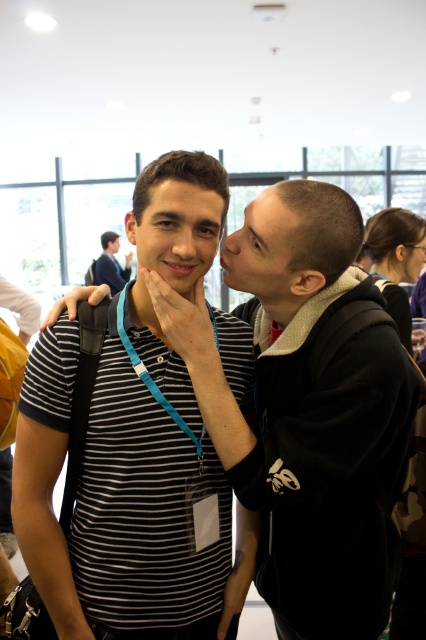
From the picture: Which is more to the right, blue fabric strap at center or blue fabric lanyard at center?

blue fabric lanyard at center

At what (x,y) coordinates should I click in order to perform the action: click on blue fabric strap at center. Please return your answer as a coordinate pair (x, y). The height and width of the screenshot is (640, 426). Looking at the image, I should click on (83, 396).

This screenshot has width=426, height=640. I want to click on blue fabric strap at center, so click(83, 396).

What do you see at coordinates (121, 508) in the screenshot? I see `striped cotton shirt at center` at bounding box center [121, 508].

Can you confirm if striped cotton shirt at center is positioned below blue fabric lanyard at center?

Yes, striped cotton shirt at center is below blue fabric lanyard at center.

Between point (57, 568) and point (166, 404), which one is positioned behind?

The point (166, 404) is behind.

You are a GUI agent. You are given a task and a screenshot of the screen. Output one action in this format:
    pyautogui.click(x=<x>, y=<y>)
    Task: Click on the striped cotton shirt at center
    Image resolution: width=426 pixels, height=640 pixels.
    Given the screenshot: What is the action you would take?
    pyautogui.click(x=121, y=508)

You are a GUI agent. You are given a task and a screenshot of the screen. Output one action in this format:
    pyautogui.click(x=<x>, y=<y>)
    Task: Click on the blue fabric lanyard at center
    
    Given the screenshot: What is the action you would take?
    pyautogui.click(x=152, y=378)

How distant is blue fabric lanyard at center from matte black shirt at upper left?

blue fabric lanyard at center and matte black shirt at upper left are 5.37 meters apart.

Find the location of `blue fabric lanyard at center`. blue fabric lanyard at center is located at coordinates (152, 378).

This screenshot has height=640, width=426. In order to click on blue fabric lanyard at center in this screenshot , I will do `click(152, 378)`.